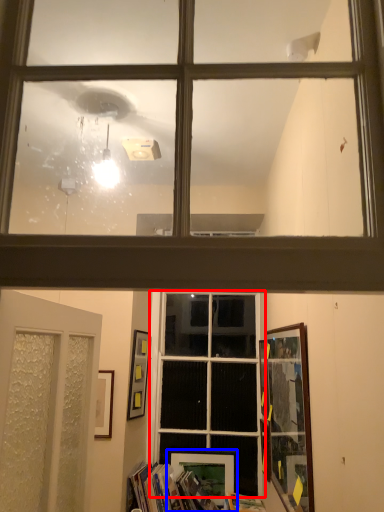
Question: Which of the following is the farthest to the observer, window (highlighted by a red box) or picture frame (highlighted by a blue box)?

Choices:
 (A) window
 (B) picture frame

Answer: (B)